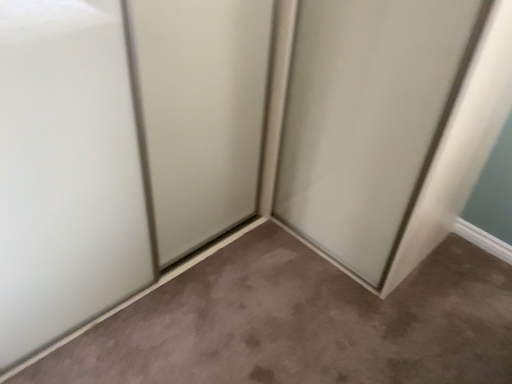
The height and width of the screenshot is (384, 512). Describe the element at coordinates (368, 119) in the screenshot. I see `satin white door at center` at that location.

Image resolution: width=512 pixels, height=384 pixels. Identify the location of satin white door at center. (368, 119).

What is the approximate height of satin white door at center?

satin white door at center is 1.20 meters in height.

Identify the location of satin white door at center. The width and height of the screenshot is (512, 384). (368, 119).